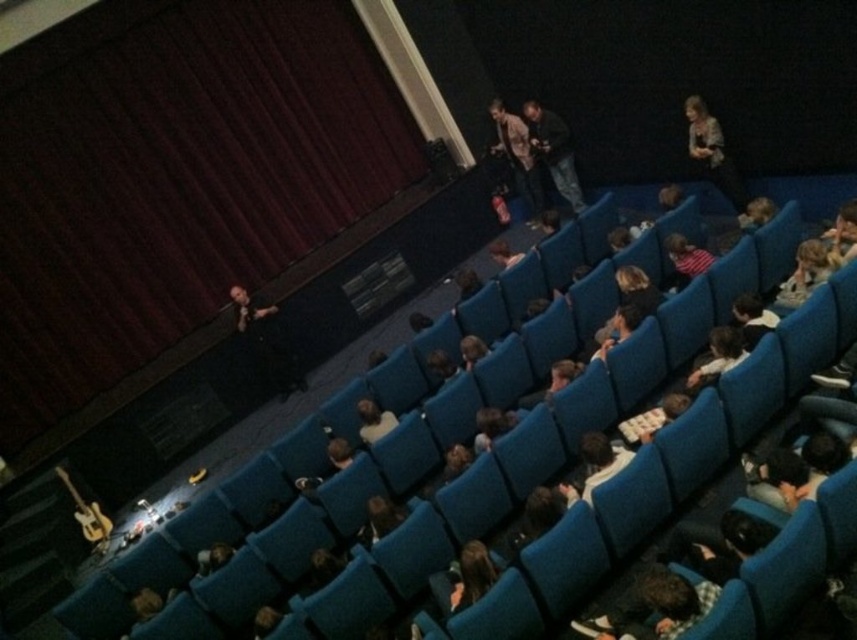
Does dark red velvet curtain at upper left appear on the left side of light brown hair at upper right?

Indeed, dark red velvet curtain at upper left is positioned on the left side of light brown hair at upper right.

The width and height of the screenshot is (857, 640). What do you see at coordinates (172, 177) in the screenshot?
I see `dark red velvet curtain at upper left` at bounding box center [172, 177].

At what (x,y) coordinates should I click in order to perform the action: click on dark red velvet curtain at upper left. Please return your answer as a coordinate pair (x, y). This screenshot has height=640, width=857. Looking at the image, I should click on (172, 177).

Is point (496, 125) farther from camera compared to point (376, 417)?

Yes, it is.

Is light brown leather jacket at upper center positioned in front of white fabric shirt at center?

No, it is not.

Find the location of a particular element. This screenshot has height=640, width=857. light brown leather jacket at upper center is located at coordinates (518, 156).

The height and width of the screenshot is (640, 857). Find the location of `light brown leather jacket at upper center`. light brown leather jacket at upper center is located at coordinates (518, 156).

Is point (361, 36) closer to camera compared to point (691, 93)?

No, (361, 36) is behind (691, 93).

Does dark red velvet curtain at upper left appear under patterned fabric jacket at upper right?

Actually, dark red velvet curtain at upper left is above patterned fabric jacket at upper right.

Locate an element on the screen. This screenshot has width=857, height=640. dark red velvet curtain at upper left is located at coordinates (172, 177).

Locate an element on the screen. dark red velvet curtain at upper left is located at coordinates (172, 177).